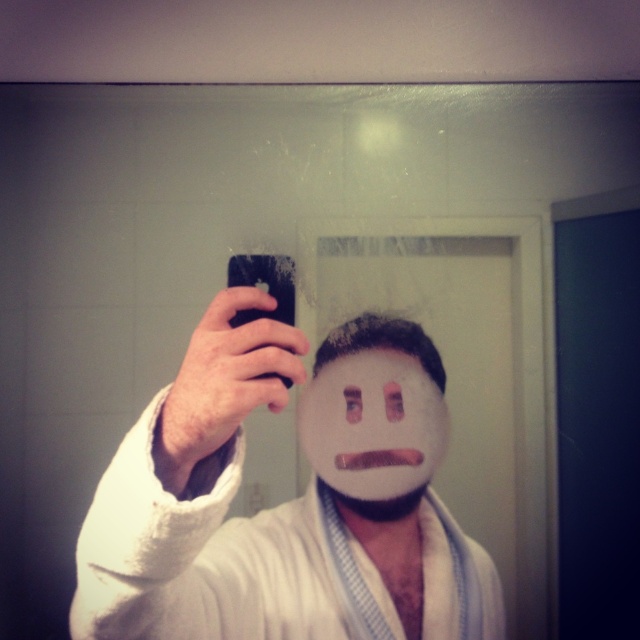
Question: Is the position of white towel at center more distant than that of white matte mask at center?

Choices:
 (A) no
 (B) yes

Answer: (A)

Question: Among these points, which one is farthest from the camera?

Choices:
 (A) (316, 392)
 (B) (396, 493)

Answer: (A)

Question: Which point is closer to the camera?

Choices:
 (A) white matte mask at center
 (B) white towel at center

Answer: (B)

Question: Observing the image, what is the correct spatial positioning of white towel at center in reference to white matte mask at center?

Choices:
 (A) right
 (B) left

Answer: (B)

Question: Can you confirm if white towel at center is positioned to the right of white matte mask at center?

Choices:
 (A) yes
 (B) no

Answer: (B)